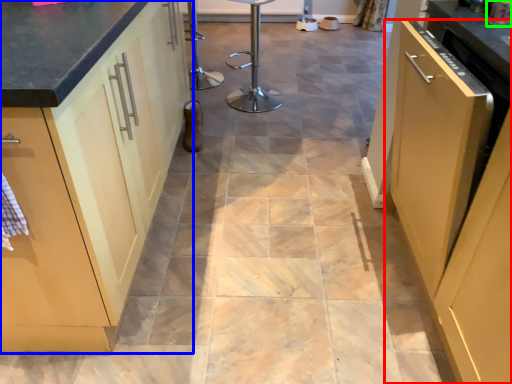
Question: Estimate the real-world distances between objects in this image. Which object is farther from cabinetry (highlighted by a red box), cabinetry (highlighted by a blue box) or appliance (highlighted by a green box)?

Choices:
 (A) cabinetry
 (B) appliance

Answer: (A)